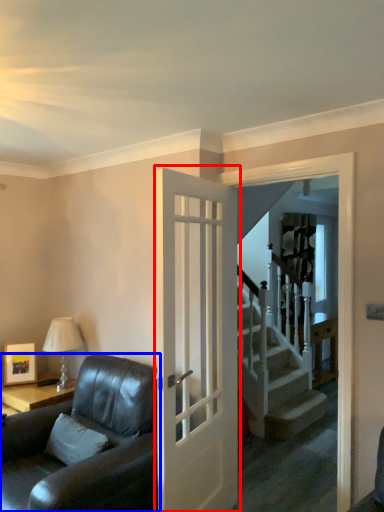
Question: Which object is closer to the camera taking this photo, door (highlighted by a red box) or studio couch (highlighted by a blue box)?

Choices:
 (A) door
 (B) studio couch

Answer: (B)